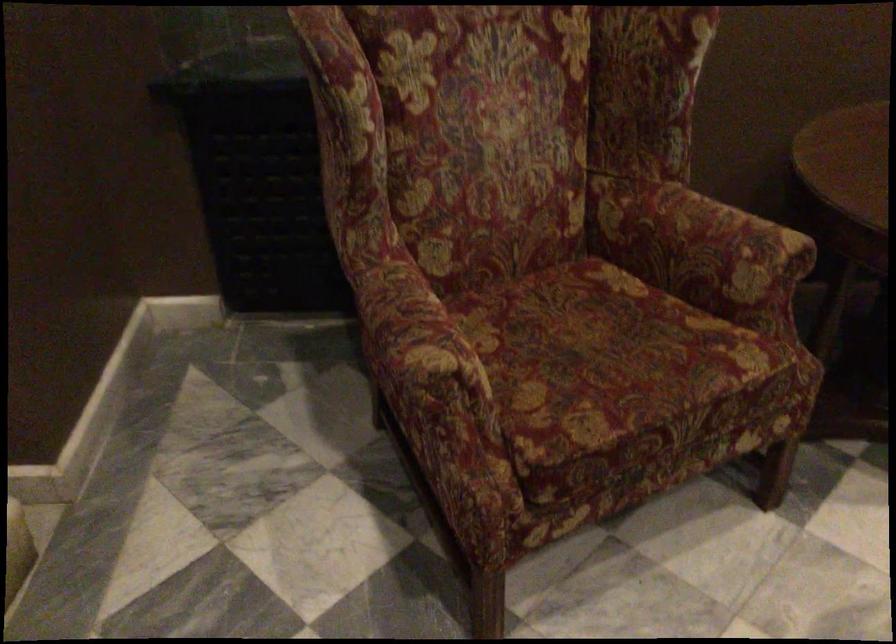
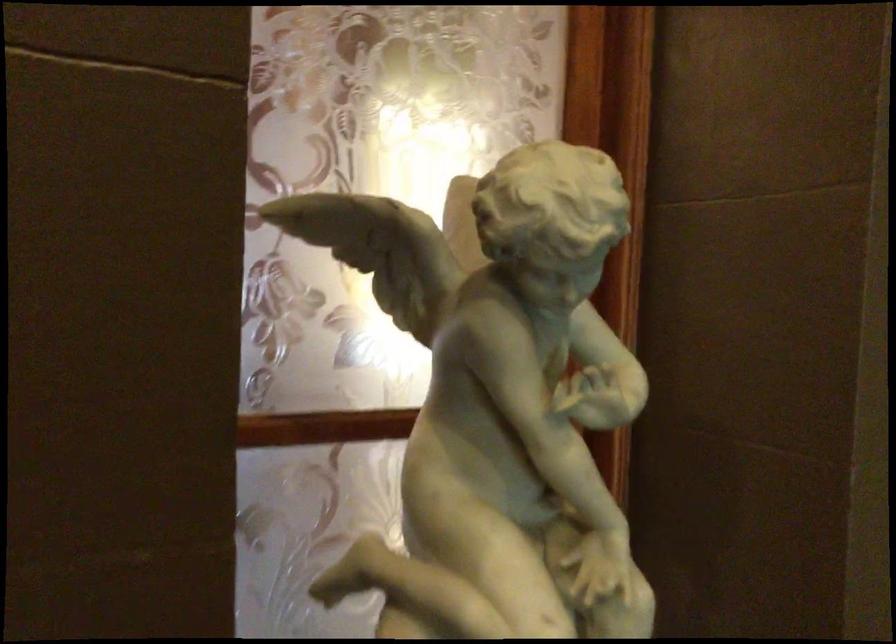
Question: The camera is either moving clockwise (left) or counter-clockwise (right) around the object. The first image is from the beginning of the video and the second image is from the end. Is the camera moving left or right when shooting the video?

Choices:
 (A) Left
 (B) Right

Answer: (B)